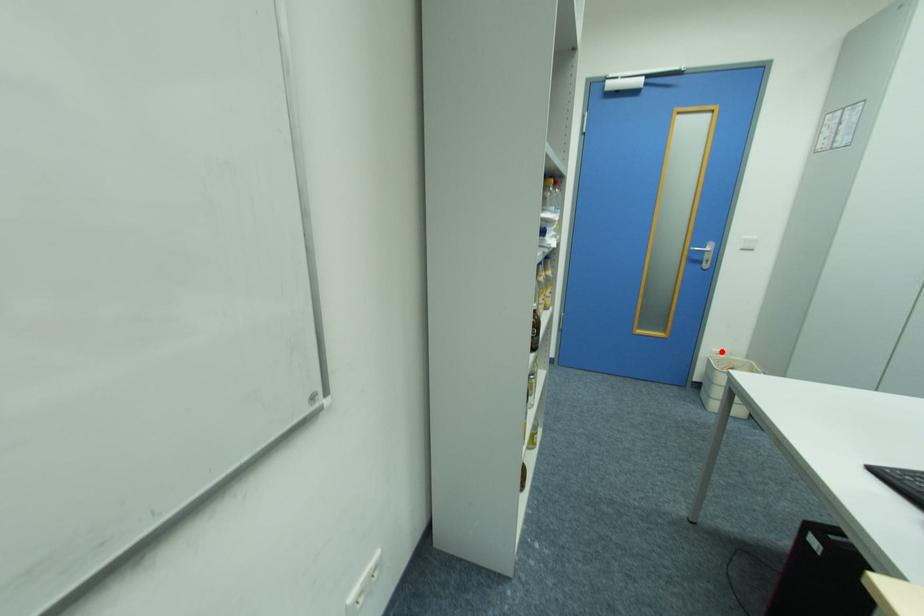
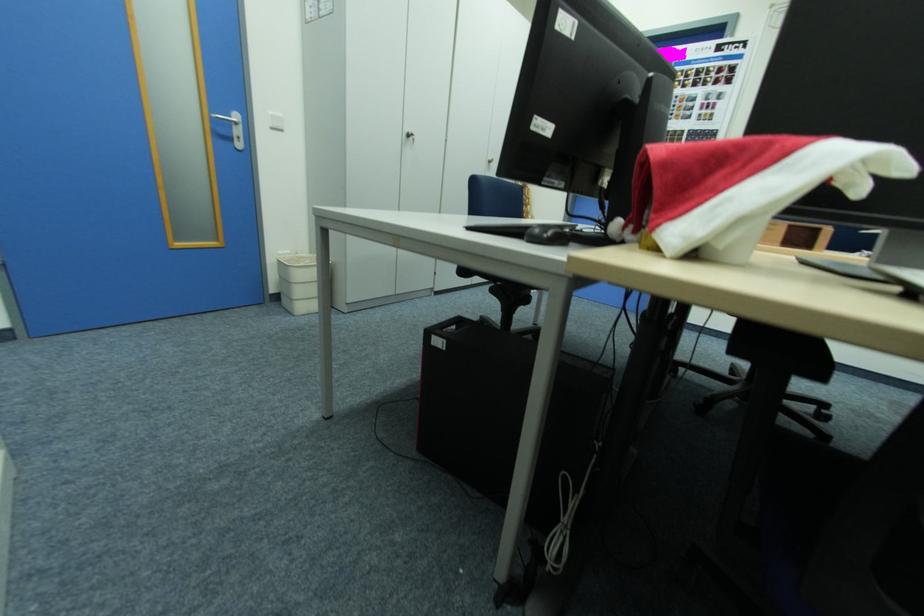
Where in the second image is the point corresponding to the highlighted location from the first image?

(286, 254)